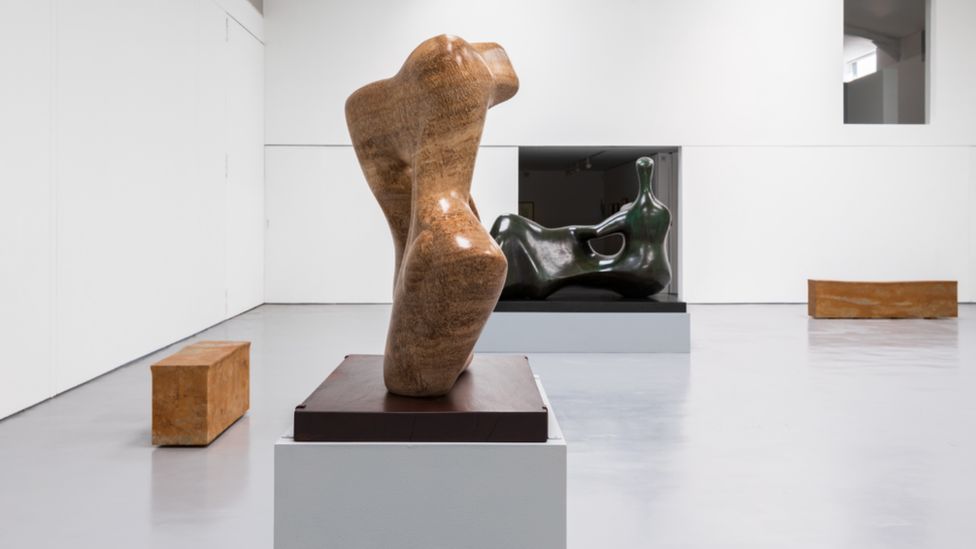
Where is `gray floor`? This screenshot has width=976, height=549. gray floor is located at coordinates (848, 431).